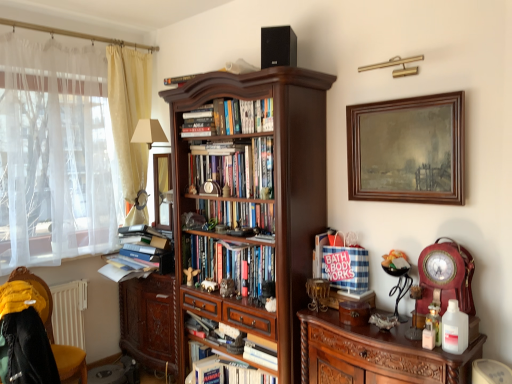
Question: Is hardcover books at center, the 5th book from the top, thinner than yellow fabric curtain at left, the first curtain viewed from the right?

Choices:
 (A) no
 (B) yes

Answer: (B)

Question: Can you confirm if hardcover books at center, the first book ordered from the bottom, is wider than yellow fabric curtain at left, marked as the second curtain in a left-to-right arrangement?

Choices:
 (A) yes
 (B) no

Answer: (B)

Question: Is hardcover books at center, the first book ordered from the bottom, closer to the viewer compared to yellow fabric curtain at left, the first curtain viewed from the right?

Choices:
 (A) no
 (B) yes

Answer: (B)

Question: Is hardcover books at center, the first book ordered from the bottom, surrounding yellow fabric curtain at left, marked as the second curtain in a left-to-right arrangement?

Choices:
 (A) no
 (B) yes

Answer: (A)

Question: From the image's perspective, is hardcover books at center, the first book ordered from the bottom, on yellow fabric curtain at left, marked as the second curtain in a left-to-right arrangement?

Choices:
 (A) no
 (B) yes

Answer: (A)

Question: In terms of size, does yellow fabric curtain at left, the first curtain viewed from the right, appear bigger or smaller than hardcover books at center, the first book ordered from the bottom?

Choices:
 (A) big
 (B) small

Answer: (A)

Question: Considering their positions, is yellow fabric curtain at left, marked as the second curtain in a left-to-right arrangement, located in front of or behind hardcover books at center, the 5th book from the top?

Choices:
 (A) behind
 (B) front

Answer: (A)

Question: From the image's perspective, is yellow fabric curtain at left, marked as the second curtain in a left-to-right arrangement, positioned above or below hardcover books at center, the first book ordered from the bottom?

Choices:
 (A) below
 (B) above

Answer: (B)

Question: From a real-world perspective, relative to hardcover books at center, the first book ordered from the bottom, is yellow fabric curtain at left, the first curtain viewed from the right, vertically above or below?

Choices:
 (A) above
 (B) below

Answer: (A)

Question: From the image's perspective, is dark wood bookcase at center located above or below hardcover books at center, acting as the 4th book starting from the top?

Choices:
 (A) below
 (B) above

Answer: (B)

Question: From a real-world perspective, relative to hardcover books at center, acting as the 4th book starting from the top, is dark wood bookcase at center vertically above or below?

Choices:
 (A) above
 (B) below

Answer: (A)

Question: Is dark wood bookcase at center bigger or smaller than hardcover books at center, which appears as the second book when ordered from the bottom?

Choices:
 (A) big
 (B) small

Answer: (A)

Question: Is dark wood bookcase at center wider or thinner than hardcover books at center, acting as the 4th book starting from the top?

Choices:
 (A) thin
 (B) wide

Answer: (B)

Question: From a real-world perspective, relative to wooden clock at right, which is the 1th picture frame from bottom to top, is yellow fabric curtain at left, the first curtain viewed from the right, vertically above or below?

Choices:
 (A) above
 (B) below

Answer: (A)

Question: Considering the positions of yellow fabric curtain at left, the first curtain viewed from the right, and wooden clock at right, the 2th picture frame when ordered from top to bottom, in the image, is yellow fabric curtain at left, the first curtain viewed from the right, wider or thinner than wooden clock at right, the 2th picture frame when ordered from top to bottom,?

Choices:
 (A) wide
 (B) thin

Answer: (A)